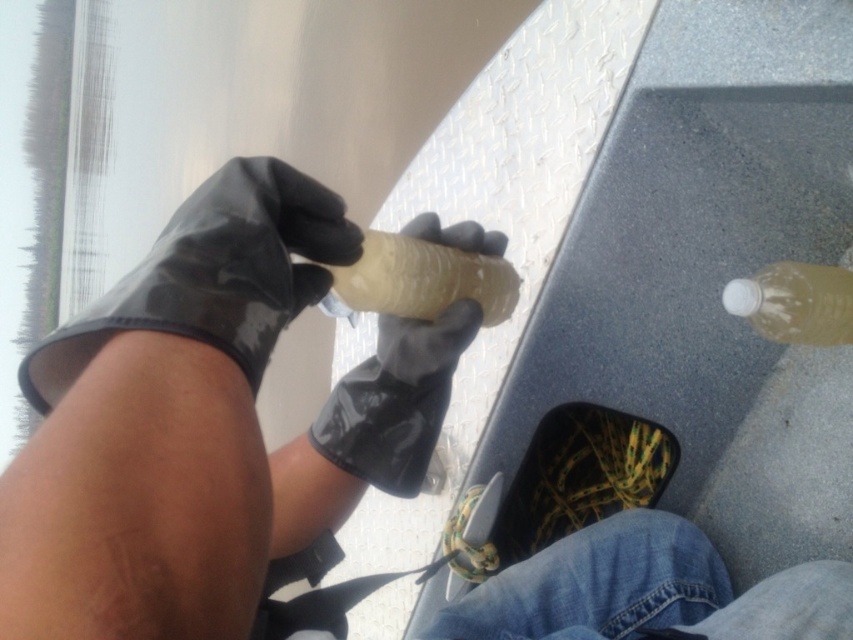
You are a researcher analyzing the image of a person holding a cylindrical object in a boat. Based on the coordinates provided, where exactly is the black rubber glove at center located in the image?

The black rubber glove at center is located at the 2D coordinates point (395, 400) in the image.

You are a researcher holding a black rubber glove at center and a translucent plastic bottle at center. Which object has a greater width?

The translucent plastic bottle at center has a greater width than the black rubber glove at center.

You are a researcher on a boat and need to store the translucent plastic bottle at lower right inside a container that can only fit items narrower than the black rubber glove at center. Will the bottle fit?

The black rubber glove at center is wider than the translucent plastic bottle at lower right, so the bottle will fit inside the container since it is narrower than the glove.